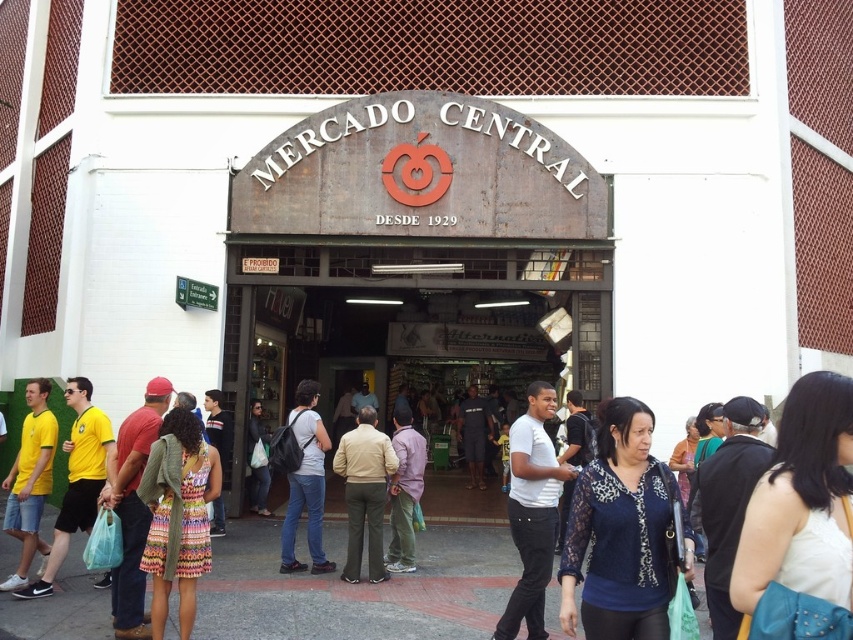
Is point (367, 490) more distant than point (314, 568)?

That is True.

Who is more distant from viewer, (364, 518) or (311, 513)?

The point (364, 518) is behind.

This screenshot has height=640, width=853. In order to click on khaki pants at center in this screenshot , I will do (x=364, y=492).

Can you confirm if yellow t-shirt at left is positioned below denim jacket at center?

Yes.

Is yellow t-shirt at left smaller than denim jacket at center?

No, yellow t-shirt at left is not smaller than denim jacket at center.

Which is in front, point (258, 566) or point (265, 448)?

Point (258, 566) is in front.

I want to click on yellow t-shirt at left, so click(x=357, y=589).

Is light purple shirt at center above denim jacket at center?

Actually, light purple shirt at center is below denim jacket at center.

Which is below, light purple shirt at center or denim jacket at center?

light purple shirt at center is below.

Who is more forward, (409, 556) or (253, 436)?

Point (409, 556)

Identify the location of light purple shirt at center. (404, 492).